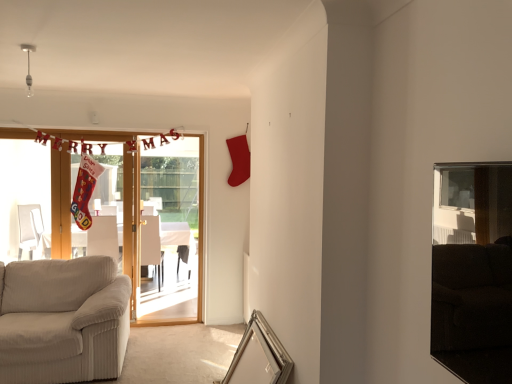
I want to click on beige fabric couch at lower left, so click(63, 320).

Where is `metallic silver picture frame at lower center`? This screenshot has width=512, height=384. metallic silver picture frame at lower center is located at coordinates (259, 356).

What do you see at coordinates (259, 356) in the screenshot?
I see `metallic silver picture frame at lower center` at bounding box center [259, 356].

At what (x,y) coordinates should I click in order to perform the action: click on white fabric armchair at left, the 1th armchair when ordered from left to right. Please return your answer as a coordinate pair (x, y). Looking at the image, I should click on (103, 237).

Where is `white fabric armchair at center, positioned as the first armchair in right-to-left order`? This screenshot has width=512, height=384. white fabric armchair at center, positioned as the first armchair in right-to-left order is located at coordinates (151, 246).

Can you tell me how much metallic silver picture frame at lower center and white fabric armchair at center, which ranks as the second armchair in left-to-right order, differ in facing direction?

There is a 84.6-degree angle between the facing directions of metallic silver picture frame at lower center and white fabric armchair at center, which ranks as the second armchair in left-to-right order.

In order to click on picture frame located below the white fabric armchair at center, positioned as the first armchair in right-to-left order (from the image's perspective) in this screenshot , I will do `click(259, 356)`.

Which object is closer to the camera taking this photo, metallic silver picture frame at lower center or white fabric armchair at center, positioned as the first armchair in right-to-left order?

metallic silver picture frame at lower center.

From a real-world perspective, between metallic silver picture frame at lower center and white fabric armchair at center, positioned as the first armchair in right-to-left order, who is vertically lower?

metallic silver picture frame at lower center is physically lower.

Considering the sizes of objects white fabric armchair at center, positioned as the first armchair in right-to-left order, and wooden door at left in the image provided, who is smaller, white fabric armchair at center, positioned as the first armchair in right-to-left order, or wooden door at left?

white fabric armchair at center, positioned as the first armchair in right-to-left order.

How far apart are white fabric armchair at center, positioned as the first armchair in right-to-left order, and wooden door at left?

A distance of 32.14 inches exists between white fabric armchair at center, positioned as the first armchair in right-to-left order, and wooden door at left.

From the image's perspective, is white fabric armchair at center, which ranks as the second armchair in left-to-right order, under wooden door at left?

Yes, from the image's perspective, white fabric armchair at center, which ranks as the second armchair in left-to-right order, is beneath wooden door at left.

Identify the location of door that appears in front of the white fabric armchair at center, positioned as the first armchair in right-to-left order. This screenshot has width=512, height=384. (201, 227).

Identify the location of studio couch that appears in front of the white fabric armchair at center, which ranks as the second armchair in left-to-right order. Image resolution: width=512 pixels, height=384 pixels. (63, 320).

Considering the relative sizes of beige fabric couch at lower left and white fabric armchair at center, positioned as the first armchair in right-to-left order, in the image provided, is beige fabric couch at lower left wider than white fabric armchair at center, positioned as the first armchair in right-to-left order,?

Correct, the width of beige fabric couch at lower left exceeds that of white fabric armchair at center, positioned as the first armchair in right-to-left order.

Is beige fabric couch at lower left taller or shorter than white fabric armchair at center, which ranks as the second armchair in left-to-right order?

beige fabric couch at lower left is shorter than white fabric armchair at center, which ranks as the second armchair in left-to-right order.

Which is in front, point (114, 276) or point (148, 226)?

The point (114, 276) is in front.

Identify the location of door above the white fabric armchair at left, marked as the 2th armchair in a right-to-left arrangement (from a real-world perspective). pos(201,227).

Which object is wider, wooden door at left or white fabric armchair at left, the 1th armchair when ordered from left to right?

white fabric armchair at left, the 1th armchair when ordered from left to right, is wider.

Would you consider wooden door at left to be distant from white fabric armchair at left, marked as the 2th armchair in a right-to-left arrangement?

Yes, wooden door at left and white fabric armchair at left, marked as the 2th armchair in a right-to-left arrangement, are quite far apart.

Is wooden door at left facing away from white fabric armchair at left, marked as the 2th armchair in a right-to-left arrangement?

Yes, wooden door at left is facing away from white fabric armchair at left, marked as the 2th armchair in a right-to-left arrangement.

From the image's perspective, is white fabric armchair at center, positioned as the first armchair in right-to-left order, on beige fabric couch at lower left?

Yes.

Which object is further away from the camera, white fabric armchair at center, positioned as the first armchair in right-to-left order, or beige fabric couch at lower left?

white fabric armchair at center, positioned as the first armchair in right-to-left order, is further away from the camera.

Does white fabric armchair at center, which ranks as the second armchair in left-to-right order, have a smaller size compared to beige fabric couch at lower left?

Yes, white fabric armchair at center, which ranks as the second armchair in left-to-right order, is smaller than beige fabric couch at lower left.

Is white fabric armchair at center, positioned as the first armchair in right-to-left order, positioned far away from white fabric armchair at left, marked as the 2th armchair in a right-to-left arrangement?

Absolutely, white fabric armchair at center, positioned as the first armchair in right-to-left order, is distant from white fabric armchair at left, marked as the 2th armchair in a right-to-left arrangement.

Is white fabric armchair at center, positioned as the first armchair in right-to-left order, facing away from white fabric armchair at left, the 1th armchair when ordered from left to right?

white fabric armchair at center, positioned as the first armchair in right-to-left order, does not have its back to white fabric armchair at left, the 1th armchair when ordered from left to right.

Considering the sizes of objects white fabric armchair at center, positioned as the first armchair in right-to-left order, and white fabric armchair at left, marked as the 2th armchair in a right-to-left arrangement, in the image provided, who is shorter, white fabric armchair at center, positioned as the first armchair in right-to-left order, or white fabric armchair at left, marked as the 2th armchair in a right-to-left arrangement,?

Standing shorter between the two is white fabric armchair at left, marked as the 2th armchair in a right-to-left arrangement.

You are a GUI agent. You are given a task and a screenshot of the screen. Output one action in this format:
    pyautogui.click(x=<x>, y=<y>)
    Task: Click on the armchair below the white fabric armchair at left, marked as the 2th armchair in a right-to-left arrangement (from a real-world perspective)
    
    Given the screenshot: What is the action you would take?
    pyautogui.click(x=151, y=246)

Is wooden door at left turned away from metallic silver picture frame at lower center?

No, metallic silver picture frame at lower center is not at the back of wooden door at left.

Considering the positions of objects wooden door at left and metallic silver picture frame at lower center in the image provided, who is behind, wooden door at left or metallic silver picture frame at lower center?

wooden door at left is further away from the camera.

Is wooden door at left not close to metallic silver picture frame at lower center?

Yes.

The image size is (512, 384). Identify the location of door to the left of metallic silver picture frame at lower center. (201, 227).

Image resolution: width=512 pixels, height=384 pixels. What are the coordinates of `armchair that is the 1st one when counting leftward from the metallic silver picture frame at lower center` in the screenshot? It's located at (151, 246).

What are the coordinates of `the 2nd armchair behind the wooden door at left, starting your count from the anchor` in the screenshot? It's located at (151, 246).

Based on the photo, from the image, which object appears to be farther from metallic silver picture frame at lower center, wooden door at left or white fabric armchair at center, which ranks as the second armchair in left-to-right order?

Based on the image, white fabric armchair at center, which ranks as the second armchair in left-to-right order, appears to be further to metallic silver picture frame at lower center.

When comparing their distances from metallic silver picture frame at lower center, does wooden door at left or beige fabric couch at lower left seem further?

wooden door at left is positioned further to the anchor metallic silver picture frame at lower center.

Considering their positions, is beige fabric couch at lower left positioned further to wooden door at left than white fabric armchair at left, marked as the 2th armchair in a right-to-left arrangement?

The object further to wooden door at left is white fabric armchair at left, marked as the 2th armchair in a right-to-left arrangement.

Looking at the image, which one is located further to beige fabric couch at lower left, wooden door at left or white fabric armchair at left, the 1th armchair when ordered from left to right?

Among the two, white fabric armchair at left, the 1th armchair when ordered from left to right, is located further to beige fabric couch at lower left.

Looking at the image, which one is located further to white fabric armchair at left, marked as the 2th armchair in a right-to-left arrangement, metallic silver picture frame at lower center or white fabric armchair at center, positioned as the first armchair in right-to-left order?

metallic silver picture frame at lower center is positioned further to the anchor white fabric armchair at left, marked as the 2th armchair in a right-to-left arrangement.

When comparing their distances from white fabric armchair at left, the 1th armchair when ordered from left to right, does wooden door at left or metallic silver picture frame at lower center seem further?

metallic silver picture frame at lower center is positioned further to the anchor white fabric armchair at left, the 1th armchair when ordered from left to right.

Estimate the real-world distances between objects in this image. Which object is closer to wooden door at left, white fabric armchair at center, positioned as the first armchair in right-to-left order, or beige fabric couch at lower left?

white fabric armchair at center, positioned as the first armchair in right-to-left order.

When comparing their distances from beige fabric couch at lower left, does white fabric armchair at center, which ranks as the second armchair in left-to-right order, or white fabric armchair at left, the 1th armchair when ordered from left to right, seem closer?

white fabric armchair at center, which ranks as the second armchair in left-to-right order, is closer to beige fabric couch at lower left.

Locate an element on the screen. door located between beige fabric couch at lower left and white fabric armchair at left, marked as the 2th armchair in a right-to-left arrangement, in the depth direction is located at coordinates (201, 227).

The image size is (512, 384). I want to click on armchair positioned between metallic silver picture frame at lower center and white fabric armchair at center, positioned as the first armchair in right-to-left order, from near to far, so click(x=103, y=237).

Where is `armchair between wooden door at left and white fabric armchair at center, positioned as the first armchair in right-to-left order, along the z-axis`? The width and height of the screenshot is (512, 384). armchair between wooden door at left and white fabric armchair at center, positioned as the first armchair in right-to-left order, along the z-axis is located at coordinates (103, 237).

Find the location of a particular element. The image size is (512, 384). door between metallic silver picture frame at lower center and white fabric armchair at center, which ranks as the second armchair in left-to-right order, along the z-axis is located at coordinates (201, 227).